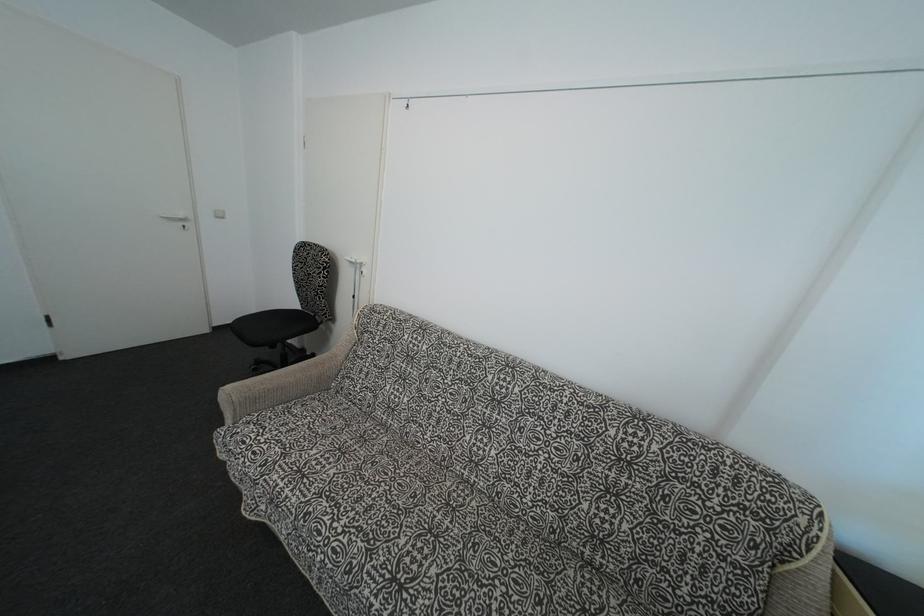
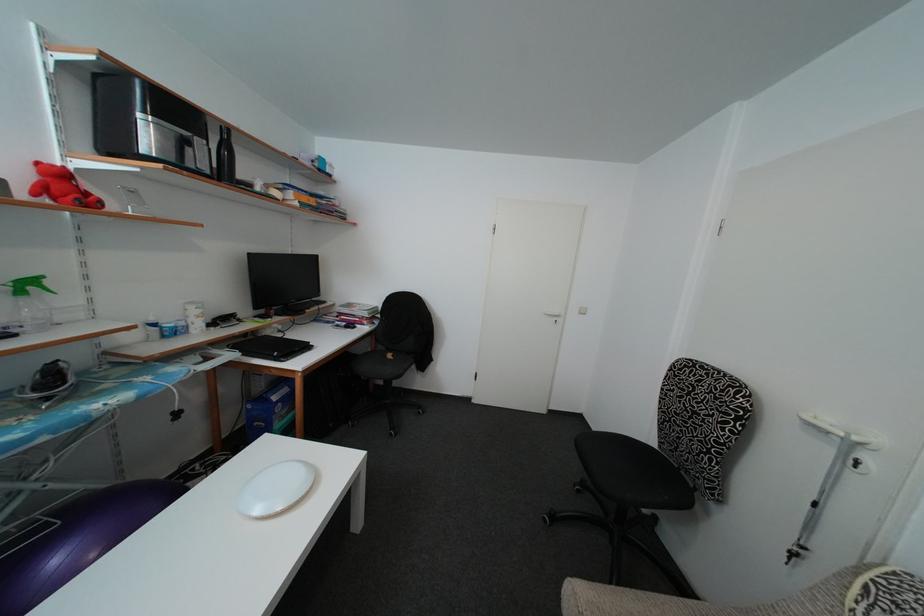
Question: The images are taken continuously from a first-person perspective. In which direction is your viewpoint rotating?

Choices:
 (A) Left
 (B) Right
 (C) Up
 (D) Down

Answer: (A)